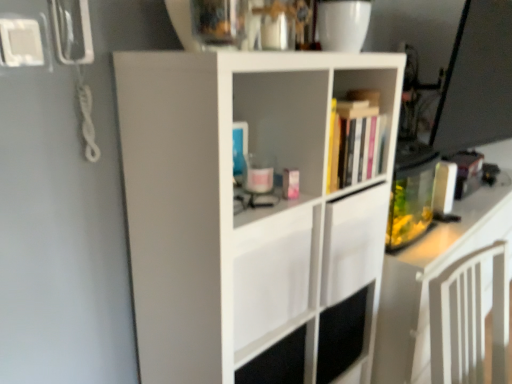
Locate an element on the screen. The height and width of the screenshot is (384, 512). hardcover books at upper center is located at coordinates point(362,123).

Image resolution: width=512 pixels, height=384 pixels. What do you see at coordinates (362, 123) in the screenshot? I see `hardcover books at upper center` at bounding box center [362, 123].

Locate an element on the screen. Image resolution: width=512 pixels, height=384 pixels. white matte cupboard at center is located at coordinates (247, 209).

The width and height of the screenshot is (512, 384). What do you see at coordinates (247, 209) in the screenshot?
I see `white matte cupboard at center` at bounding box center [247, 209].

Where is `hardcover books at upper center`? hardcover books at upper center is located at coordinates (362, 123).

Which is more to the left, white matte cupboard at center or hardcover books at upper center?

From the viewer's perspective, white matte cupboard at center appears more on the left side.

Who is more distant, white matte cupboard at center or hardcover books at upper center?

hardcover books at upper center is more distant.

Is point (366, 281) farther from camera compared to point (381, 123)?

Yes.

From the image's perspective, between white matte cupboard at center and hardcover books at upper center, who is located below?

white matte cupboard at center, from the image's perspective.

From a real-world perspective, is white matte cupboard at center physically located above or below hardcover books at upper center?

white matte cupboard at center is below hardcover books at upper center.

Can you confirm if white matte cupboard at center is wider than hardcover books at upper center?

Indeed, white matte cupboard at center has a greater width compared to hardcover books at upper center.

In terms of height, does white matte cupboard at center look taller or shorter compared to hardcover books at upper center?

white matte cupboard at center is taller than hardcover books at upper center.

Who is bigger, white matte cupboard at center or hardcover books at upper center?

white matte cupboard at center is bigger.

Is white matte cupboard at center positioned beyond the bounds of hardcover books at upper center?

Indeed, white matte cupboard at center is completely outside hardcover books at upper center.

Is there a large distance between white matte cupboard at center and hardcover books at upper center?

No, white matte cupboard at center is not far from hardcover books at upper center.

Is white matte cupboard at center facing towards hardcover books at upper center?

Yes, white matte cupboard at center faces towards hardcover books at upper center.

This screenshot has height=384, width=512. Find the location of `cupboard below the hardcover books at upper center (from the image's perspective)`. cupboard below the hardcover books at upper center (from the image's perspective) is located at coordinates (247, 209).

Between hardcover books at upper center and white matte cupboard at center, which one appears on the right side from the viewer's perspective?

hardcover books at upper center is more to the right.

Which object is further away from the camera taking this photo, hardcover books at upper center or white matte cupboard at center?

hardcover books at upper center is more distant.

Between point (382, 164) and point (322, 112), which one is positioned behind?

The point (382, 164) is farther.

From the image's perspective, is hardcover books at upper center positioned above or below white matte cupboard at center?

From the image's perspective, hardcover books at upper center appears above white matte cupboard at center.

Looking at this image, from a real-world perspective, is hardcover books at upper center positioned above or below white matte cupboard at center?

hardcover books at upper center is above white matte cupboard at center.

Looking at their sizes, would you say hardcover books at upper center is wider or thinner than white matte cupboard at center?

Clearly, hardcover books at upper center has less width compared to white matte cupboard at center.

From their relative heights in the image, would you say hardcover books at upper center is taller or shorter than white matte cupboard at center?

Clearly, hardcover books at upper center is shorter compared to white matte cupboard at center.

Does hardcover books at upper center have a larger size compared to white matte cupboard at center?

No, hardcover books at upper center is not bigger than white matte cupboard at center.

Is hardcover books at upper center located outside white matte cupboard at center?

Actually, hardcover books at upper center is within white matte cupboard at center.

Is hardcover books at upper center next to white matte cupboard at center and touching it?

No, hardcover books at upper center is not with white matte cupboard at center.

Is hardcover books at upper center facing away from white matte cupboard at center?

Yes, white matte cupboard at center is at the back of hardcover books at upper center.

Where is `shelf on the right of white matte cupboard at center`? The image size is (512, 384). shelf on the right of white matte cupboard at center is located at coordinates (362, 123).

Identify the location of cupboard that appears in front of the hardcover books at upper center. (247, 209).

Locate an element on the screen. shelf that appears above the white matte cupboard at center (from the image's perspective) is located at coordinates (362, 123).